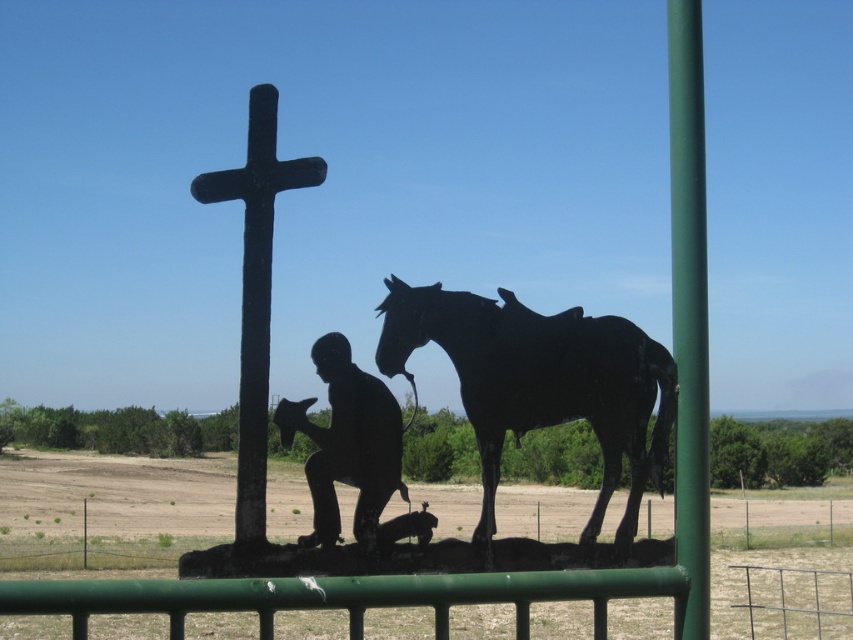
Who is higher up, green metal fence at lower center or green metallic pole at right?

green metallic pole at right is higher up.

Identify the location of green metal fence at lower center. (729, 602).

Does point (4, 628) come closer to viewer compared to point (682, 193)?

That is False.

Locate an element on the screen. The width and height of the screenshot is (853, 640). green metal fence at lower center is located at coordinates (729, 602).

Looking at this image, which of these two, black matte horse at center or matte black statue at center, stands shorter?

matte black statue at center

The image size is (853, 640). Describe the element at coordinates (541, 384) in the screenshot. I see `black matte horse at center` at that location.

Identify the location of black matte horse at center. (541, 384).

Is point (532, 362) closer to viewer compared to point (33, 625)?

Yes, point (532, 362) is closer to viewer.

Is black matte horse at center smaller than green metal fence at lower center?

Correct, black matte horse at center occupies less space than green metal fence at lower center.

Who is more forward, (635, 355) or (473, 612)?

Point (635, 355)

The image size is (853, 640). In order to click on black matte horse at center in this screenshot , I will do click(x=541, y=384).